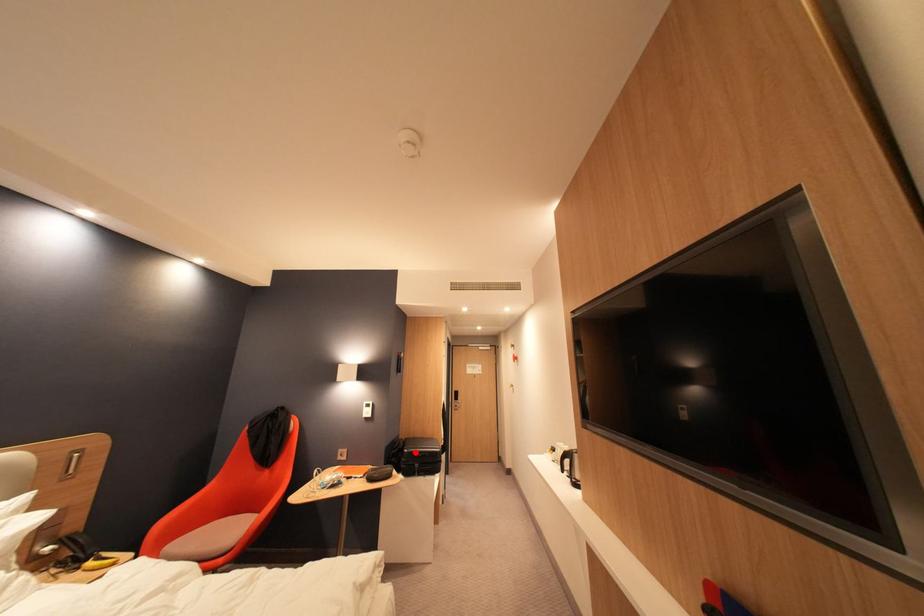
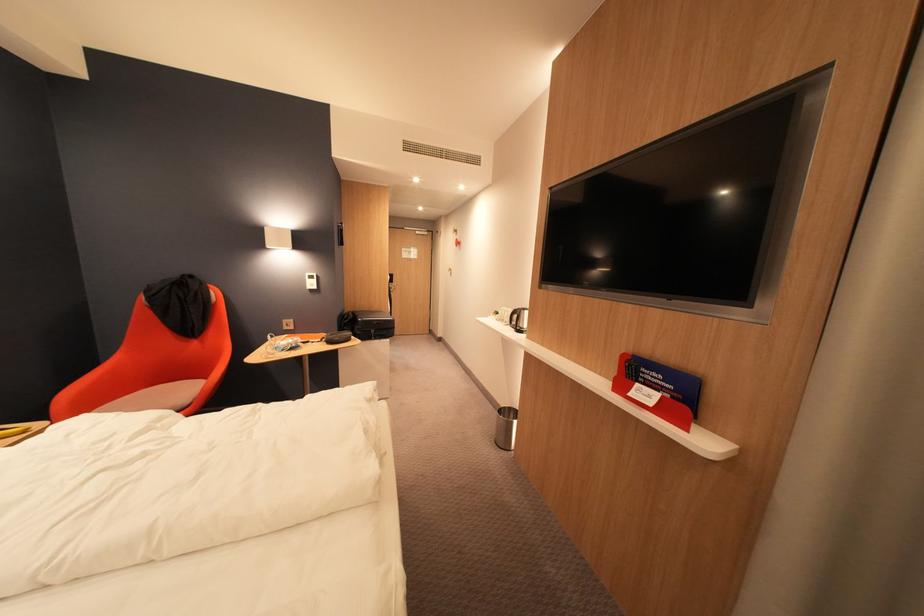
Find the pixel in the second image that matches the highlighted location in the first image.

(370, 321)